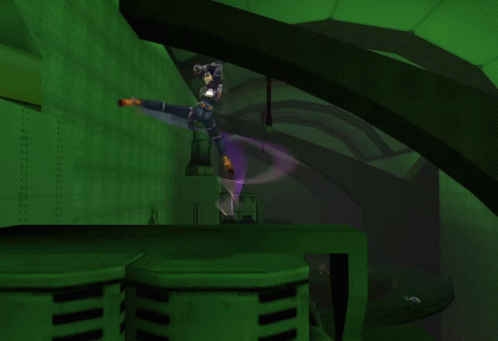
This screenshot has height=341, width=498. I want to click on wall, so click(x=100, y=143).